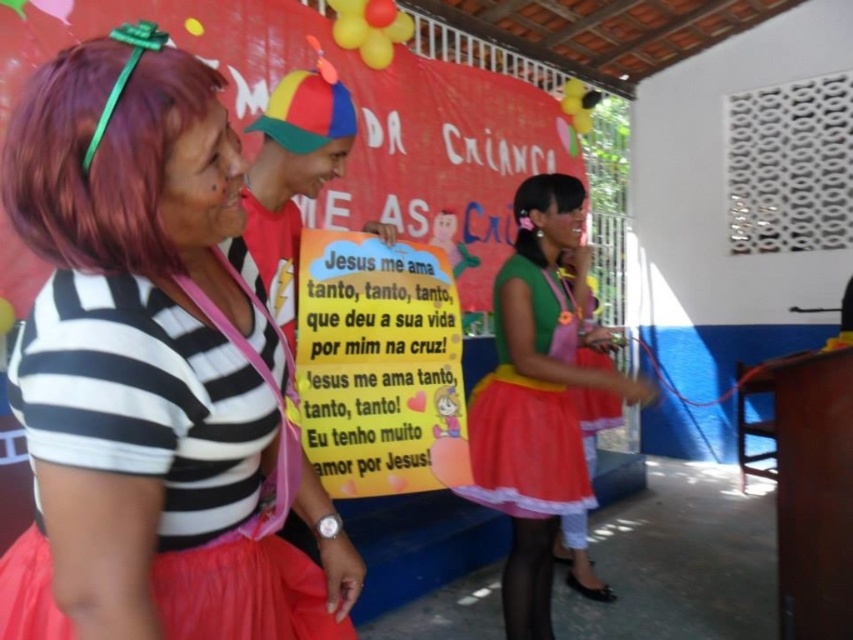
You are organizing a photo shoot and need to ensure that the matte black shirt at center and the purple silky hair at left are framed properly. Given their sizes, which object should be placed closer to the camera to maintain proportion?

The purple silky hair at left should be placed closer to the camera since it is smaller in width compared to the matte black shirt at center, ensuring both appear proportionate in the photo.

What is the color of the hair at the point with coordinates (102, 150)?

The point at coordinates (102, 150) corresponds to purple silky hair at left.